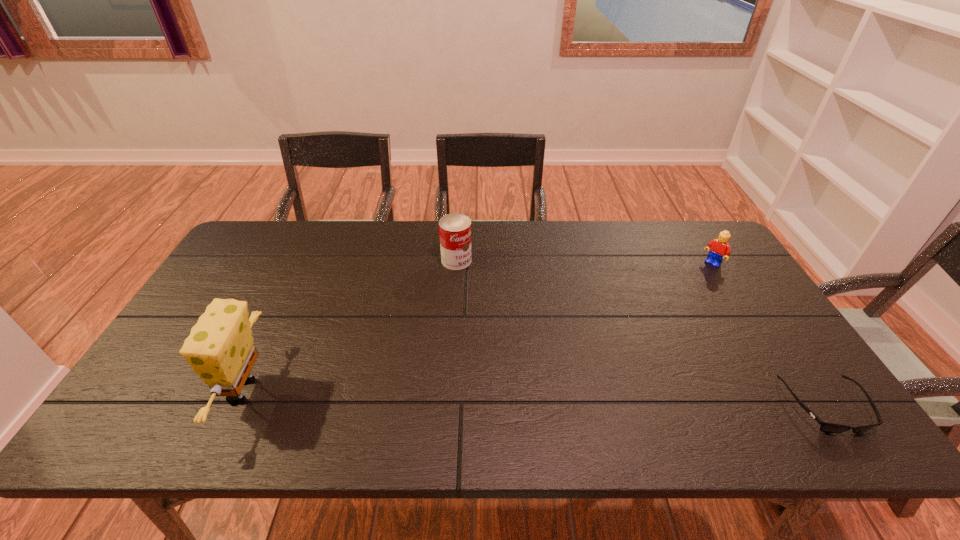
At what (x,y) coordinates should I click in order to perform the action: click on unoccupied position between the tallest object and the third object from right to left. Please return your answer as a coordinate pair (x, y). The image size is (960, 540). Looking at the image, I should click on (350, 326).

Locate an element on the screen. The height and width of the screenshot is (540, 960). free space between the can and the sunglasses is located at coordinates (641, 333).

Identify the location of free space that is in between the third object from right to left and the sunglasses. (641, 333).

Identify the location of free area in between the sponge and the sunglasses. This screenshot has width=960, height=540. (535, 399).

Locate an element on the screen. This screenshot has width=960, height=540. vacant area that lies between the second tallest object and the shortest object is located at coordinates (641, 333).

Find the location of a particular element. free point between the can and the shortest object is located at coordinates (641, 333).

Locate an element on the screen. The image size is (960, 540). free space between the third object from right to left and the leftmost object is located at coordinates (350, 326).

Locate an element on the screen. This screenshot has width=960, height=540. object that is the third closest to the shortest object is located at coordinates (220, 348).

The width and height of the screenshot is (960, 540). In order to click on object that ranks as the third closest to the Lego in this screenshot , I will do `click(220, 348)`.